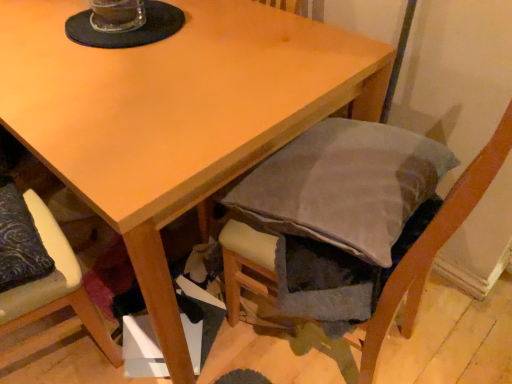
Question: Should I look upward or downward to see velvet gray cushion at lower right, the first chair viewed from the right?

Choices:
 (A) down
 (B) up

Answer: (A)

Question: Considering the relative positions of velvet gray cushion at lower right, the first chair viewed from the right, and velvet-like beige cushion at lower left, which ranks as the second chair in right-to-left order, in the image provided, is velvet gray cushion at lower right, the first chair viewed from the right, to the right of velvet-like beige cushion at lower left, which ranks as the second chair in right-to-left order, from the viewer's perspective?

Choices:
 (A) yes
 (B) no

Answer: (A)

Question: Is velvet gray cushion at lower right, positioned as the 2th chair in left-to-right order, wider than velvet-like beige cushion at lower left, which ranks as the second chair in right-to-left order?

Choices:
 (A) yes
 (B) no

Answer: (A)

Question: Is velvet gray cushion at lower right, the first chair viewed from the right, thinner than velvet-like beige cushion at lower left, acting as the 1th chair starting from the left?

Choices:
 (A) no
 (B) yes

Answer: (A)

Question: Does velvet gray cushion at lower right, positioned as the 2th chair in left-to-right order, have a smaller size compared to velvet-like beige cushion at lower left, which ranks as the second chair in right-to-left order?

Choices:
 (A) no
 (B) yes

Answer: (A)

Question: From the image's perspective, is velvet gray cushion at lower right, positioned as the 2th chair in left-to-right order, under velvet-like beige cushion at lower left, acting as the 1th chair starting from the left?

Choices:
 (A) no
 (B) yes

Answer: (A)

Question: Is velvet gray cushion at lower right, the first chair viewed from the right, not close to velvet-like beige cushion at lower left, which ranks as the second chair in right-to-left order?

Choices:
 (A) no
 (B) yes

Answer: (A)

Question: Does velvet-like beige cushion at lower left, acting as the 1th chair starting from the left, have a lesser height compared to velvet gray cushion at lower right, positioned as the 2th chair in left-to-right order?

Choices:
 (A) yes
 (B) no

Answer: (A)

Question: Is velvet-like beige cushion at lower left, which ranks as the second chair in right-to-left order, facing away from velvet gray cushion at lower right, the first chair viewed from the right?

Choices:
 (A) no
 (B) yes

Answer: (A)

Question: Can you confirm if velvet-like beige cushion at lower left, which ranks as the second chair in right-to-left order, is positioned to the left of velvet gray cushion at lower right, the first chair viewed from the right?

Choices:
 (A) no
 (B) yes

Answer: (B)

Question: Is velvet gray cushion at lower right, the first chair viewed from the right, surrounded by velvet-like beige cushion at lower left, acting as the 1th chair starting from the left?

Choices:
 (A) yes
 (B) no

Answer: (B)

Question: From the image's perspective, is velvet-like beige cushion at lower left, acting as the 1th chair starting from the left, over velvet gray cushion at lower right, positioned as the 2th chair in left-to-right order?

Choices:
 (A) no
 (B) yes

Answer: (A)

Question: Does velvet-like beige cushion at lower left, acting as the 1th chair starting from the left, come in front of velvet gray cushion at lower right, positioned as the 2th chair in left-to-right order?

Choices:
 (A) no
 (B) yes

Answer: (A)

Question: Which is correct: velvet-like beige cushion at lower left, acting as the 1th chair starting from the left, is inside velvet gray cushion at lower right, positioned as the 2th chair in left-to-right order, or outside of it?

Choices:
 (A) outside
 (B) inside

Answer: (A)